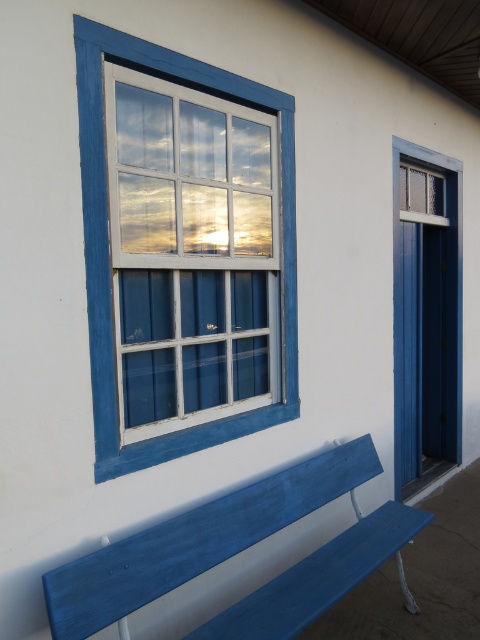
Between point (338, 580) and point (285, 342), which one is positioned in front?

Point (338, 580)

Is point (260, 609) more distant than point (87, 140)?

Yes, point (260, 609) is farther from viewer.

The width and height of the screenshot is (480, 640). I want to click on matte blue bench at lower center, so click(x=239, y=552).

What do you see at coordinates (108, 244) in the screenshot? I see `blue painted wood window at upper left` at bounding box center [108, 244].

Who is lower down, blue painted wood window at upper left or blue painted wood door at right?

Positioned lower is blue painted wood door at right.

Does point (94, 262) come in front of point (403, 216)?

Yes, point (94, 262) is closer to viewer.

Locate an element on the screen. Image resolution: width=480 pixels, height=640 pixels. blue painted wood window at upper left is located at coordinates (108, 244).

Between matte blue bench at lower center and blue painted wood door at right, which one is positioned higher?

blue painted wood door at right

Locate an element on the screen. matte blue bench at lower center is located at coordinates (239, 552).

Locate an element on the screen. The image size is (480, 640). matte blue bench at lower center is located at coordinates (239, 552).